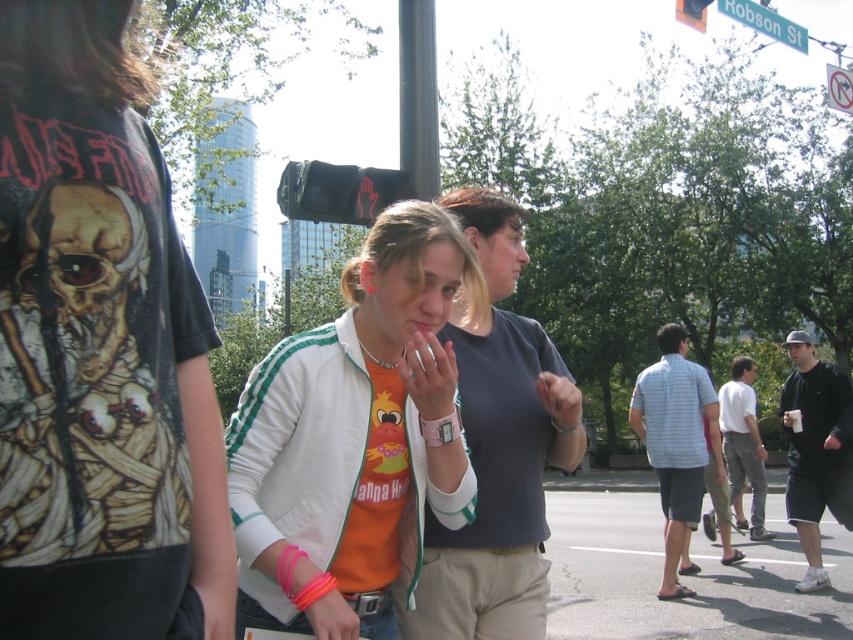
Question: Which of the following is the farthest from the observer?

Choices:
 (A) light blue plaid shirt at center
 (B) metallic pole at upper center
 (C) matte gray shirt at center
 (D) white matte jacket at center

Answer: (A)

Question: Is matte gray shirt at center smaller than black cotton t-shirt at right?

Choices:
 (A) no
 (B) yes

Answer: (B)

Question: Does metallic pole at upper center have a lesser width compared to blue plastic street sign at upper center?

Choices:
 (A) no
 (B) yes

Answer: (B)

Question: Does metallic pole at upper center appear on the right side of white cotton shirt at right?

Choices:
 (A) no
 (B) yes

Answer: (A)

Question: Which point is closer to the camera taking this photo?

Choices:
 (A) (734, 388)
 (B) (486, 506)
 (C) (840, 522)
 (D) (724, 0)

Answer: (B)

Question: Among these points, which one is farthest from the camera?

Choices:
 (A) (534, 476)
 (B) (730, 1)

Answer: (B)